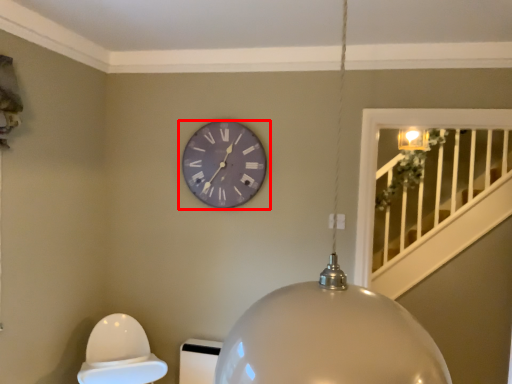
Question: Observing the image, what is the correct spatial positioning of wall clock (annotated by the red box) in reference to lamp?

Choices:
 (A) left
 (B) right

Answer: (A)